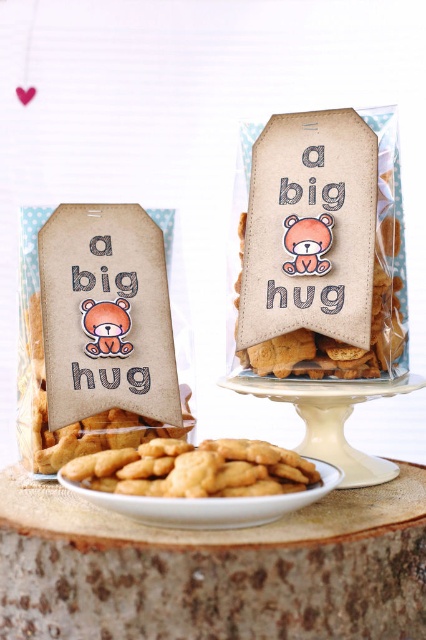
Can you confirm if brown wood table at center is positioned below matte brown tag at center?

Indeed, brown wood table at center is positioned under matte brown tag at center.

Is brown wood table at center above matte brown tag at center?

No.

Image resolution: width=426 pixels, height=640 pixels. What do you see at coordinates (215, 570) in the screenshot? I see `brown wood table at center` at bounding box center [215, 570].

This screenshot has height=640, width=426. In order to click on brown wood table at center in this screenshot , I will do `click(215, 570)`.

Is brown wood table at center positioned at the back of golden crumbly cookies at center?

No, brown wood table at center is closer to the viewer.

Between brown wood table at center and golden crumbly cookies at center, which one is positioned higher?

golden crumbly cookies at center is above.

Does point (69, 586) come in front of point (305, 476)?

Yes, it is.

The image size is (426, 640). I want to click on brown wood table at center, so click(x=215, y=570).

Can you confirm if matte brown tag at center is positioned above baked brown cookie at left?

Correct, matte brown tag at center is located above baked brown cookie at left.

Image resolution: width=426 pixels, height=640 pixels. I want to click on matte brown tag at center, so click(322, 246).

Where is `matte brown tag at center`? matte brown tag at center is located at coordinates (322, 246).